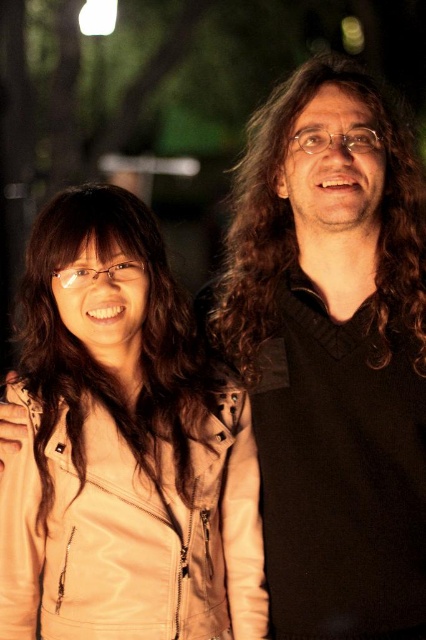
Consider the image. You are a photographer adjusting your camera settings to focus on the black matte sweater at right. What coordinates should you input to ensure the sweater is in sharp focus?

The black matte sweater at right is located at coordinates point (333, 353), so you should input those coordinates to focus on it.

You are a photographer adjusting your camera settings for a night portrait. You notice the black matte sweater at right and the tan leather jacket at left in the frame. Which clothing item appears taller in the photo?

The black matte sweater at right is taller than the tan leather jacket at left in the photo.

You are a photographer adjusting your camera settings to focus on two points in the image. The first point is at coordinates point [308,504] and the second is at point [132,465]. Which point should you focus on first if you want to ensure the closest object is in sharp focus?

Point [308,504] is further to the viewer than point [132,465], so you should focus on point [308,504] first to capture the closest object in sharp focus.